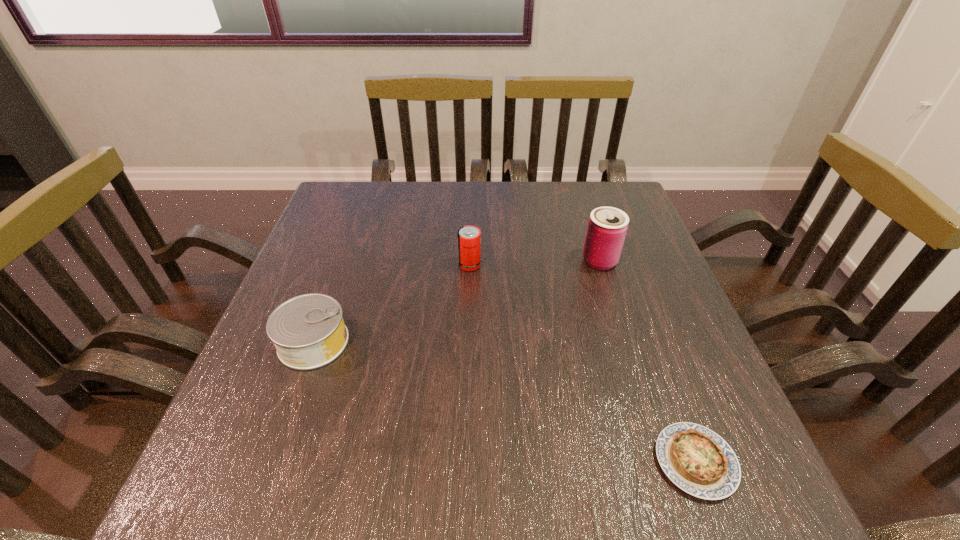
This screenshot has height=540, width=960. What are the coordinates of `vacant space at the far left corner of the desktop` in the screenshot? It's located at (338, 183).

Locate an element on the screen. This screenshot has height=540, width=960. free space at the far right corner of the desktop is located at coordinates (604, 201).

Locate an element on the screen. The width and height of the screenshot is (960, 540). vacant area that lies between the nearest object and the second tallest object is located at coordinates (583, 363).

At what (x,y) coordinates should I click in order to perform the action: click on unoccupied area between the rightmost can and the shortest object. Please return your answer as a coordinate pair (x, y). Looking at the image, I should click on (648, 361).

Where is `vacant area between the shortest object and the second tallest can`? vacant area between the shortest object and the second tallest can is located at coordinates (583, 363).

Find the location of a particular element. The image size is (960, 540). vacant area that lies between the rightmost can and the shortest can is located at coordinates (457, 302).

Locate an element on the screen. This screenshot has width=960, height=540. empty space that is in between the second can from left to right and the tallest can is located at coordinates (535, 263).

You are a GUI agent. You are given a task and a screenshot of the screen. Output one action in this format:
    pyautogui.click(x=<x>, y=<y>)
    Task: Click on the vacant space that's between the second can from right to left and the nearest can
    
    Given the screenshot: What is the action you would take?
    pyautogui.click(x=392, y=303)

I want to click on unoccupied position between the tallest can and the shortest object, so click(x=648, y=361).

I want to click on vacant point located between the leftmost object and the second can from left to right, so point(392,303).